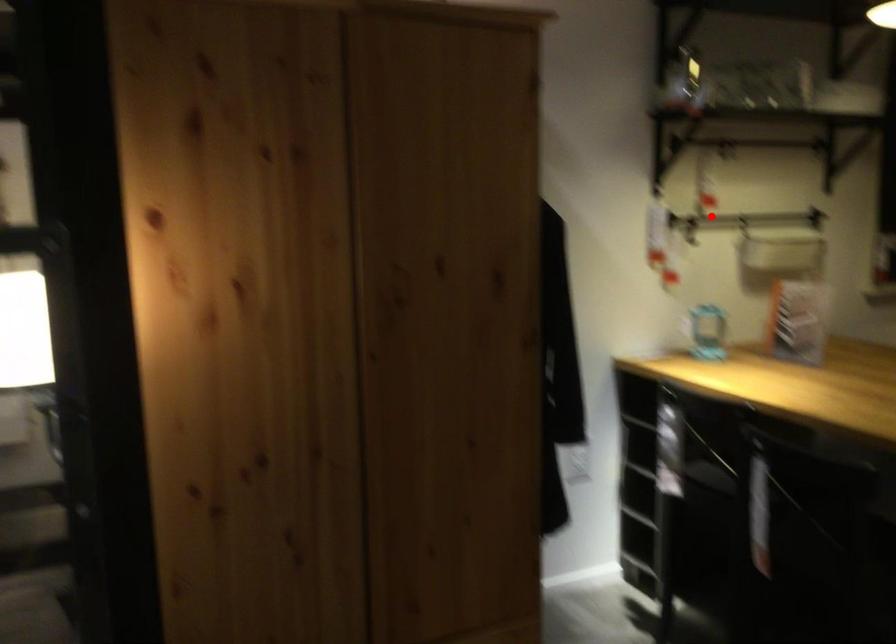
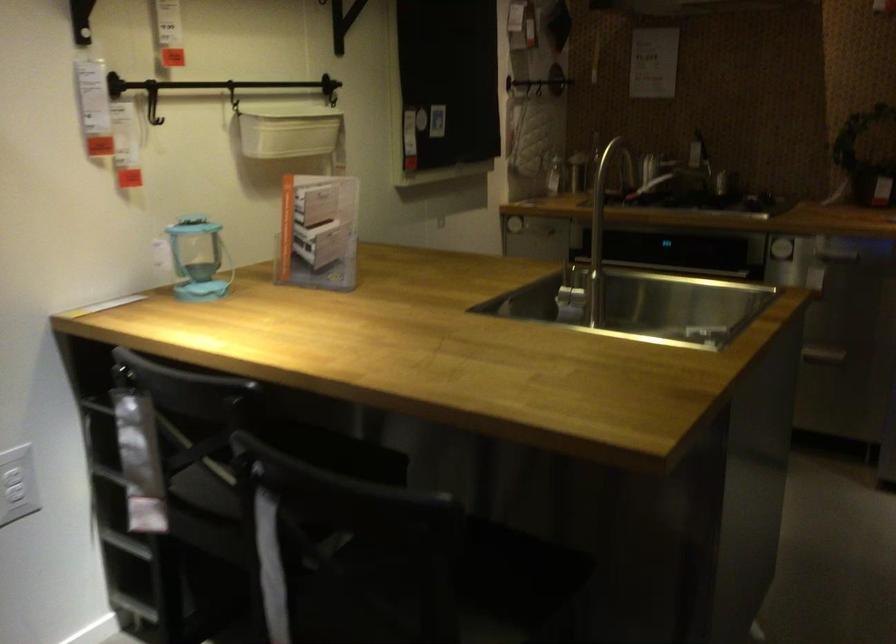
In the second image, find the point that corresponds to the highlighted location in the first image.

(152, 100)